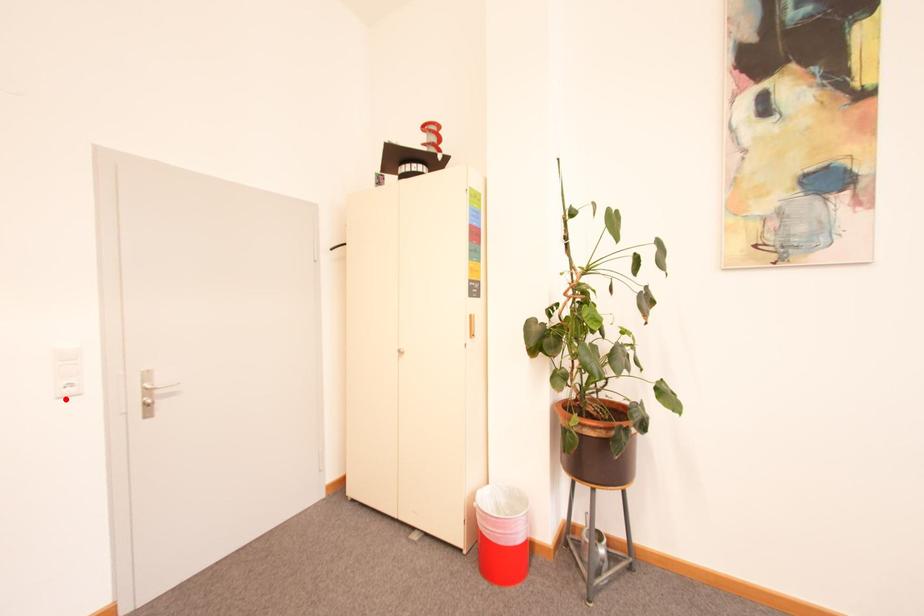
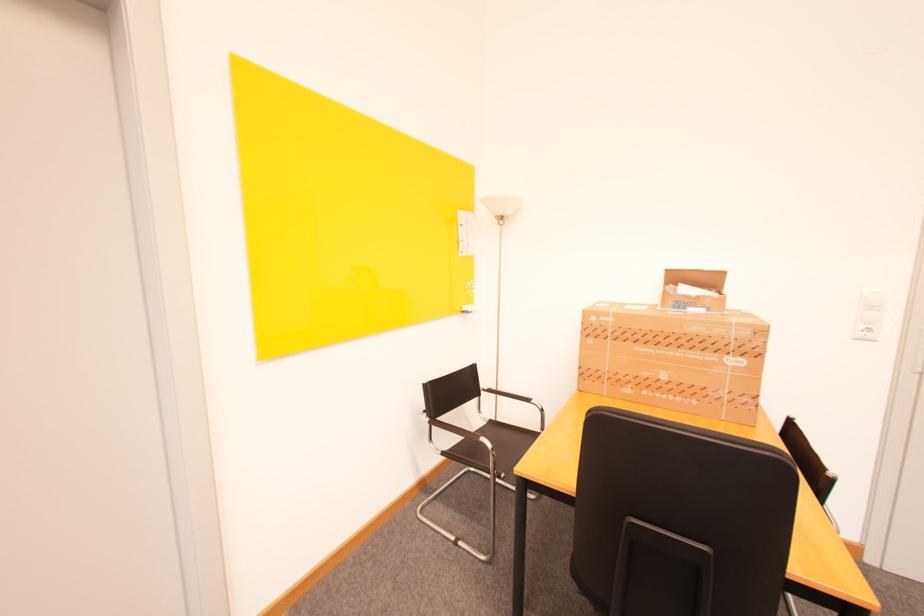
In the second image, find the point that corresponds to the highlighted location in the first image.

(862, 339)